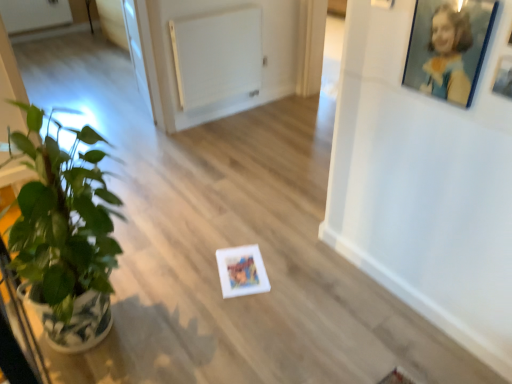
You are a GUI agent. You are given a task and a screenshot of the screen. Output one action in this format:
    pyautogui.click(x=<x>, y=<y>)
    Task: Click on the unoccupied region to the right of green glossy houseplant at left
    
    Given the screenshot: What is the action you would take?
    pyautogui.click(x=200, y=314)